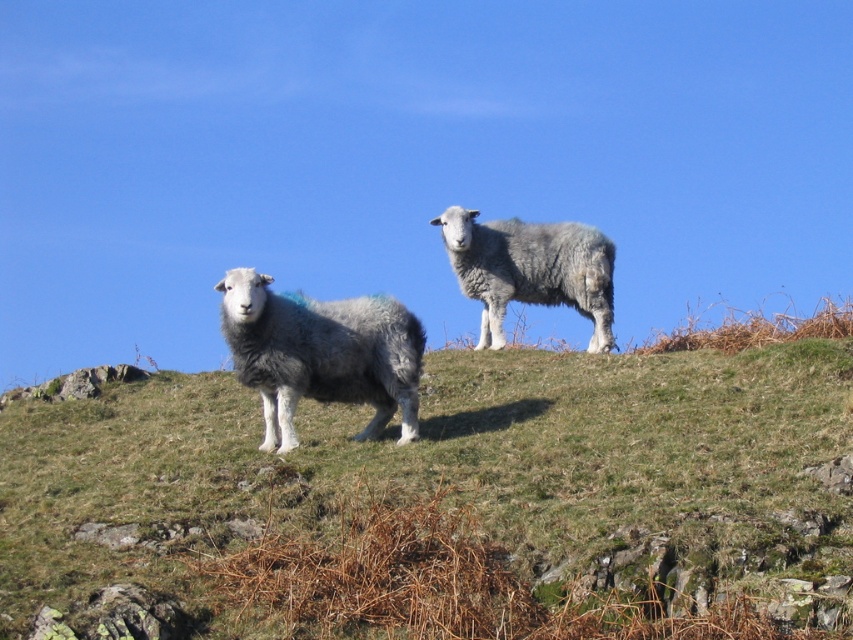
Is green grassy at center bigger than fuzzy gray sheep at center?

Yes, green grassy at center is bigger than fuzzy gray sheep at center.

Is point (4, 572) closer to viewer compared to point (293, 371)?

Yes, point (4, 572) is closer to viewer.

Locate an element on the screen. This screenshot has width=853, height=640. green grassy at center is located at coordinates (437, 499).

I want to click on green grassy at center, so click(x=437, y=499).

Can you confirm if fuzzy gray sheep at center is taller than gray woolly sheep at center?

Incorrect, fuzzy gray sheep at center's height is not larger of gray woolly sheep at center's.

Does fuzzy gray sheep at center appear over gray woolly sheep at center?

Incorrect, fuzzy gray sheep at center is not positioned above gray woolly sheep at center.

What do you see at coordinates (321, 353) in the screenshot? I see `fuzzy gray sheep at center` at bounding box center [321, 353].

Locate an element on the screen. The height and width of the screenshot is (640, 853). fuzzy gray sheep at center is located at coordinates (321, 353).

Between green grassy at center and gray woolly sheep at center, which one has more height?

With more height is gray woolly sheep at center.

Between point (194, 509) and point (573, 289), which one is positioned behind?

Point (573, 289)

Is point (206, 534) closer to camera compared to point (492, 304)?

Yes, it is.

You are a GUI agent. You are given a task and a screenshot of the screen. Output one action in this format:
    pyautogui.click(x=<x>, y=<y>)
    Task: Click on the green grassy at center
    
    Given the screenshot: What is the action you would take?
    pyautogui.click(x=437, y=499)